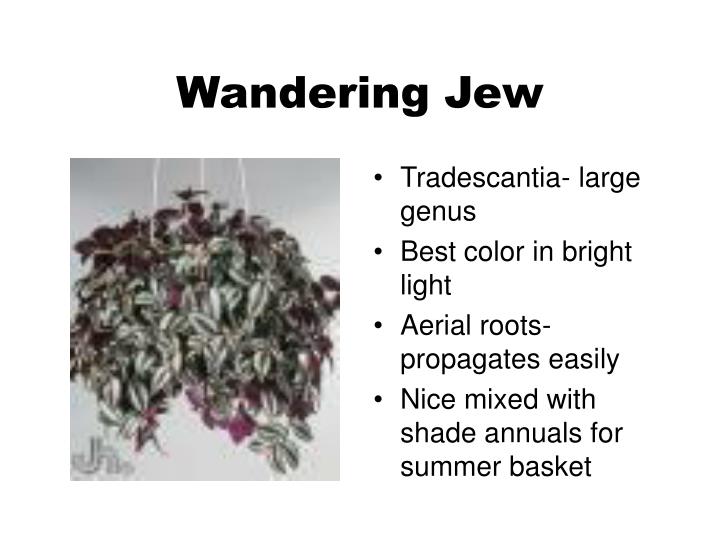
The image size is (720, 540). I want to click on plant, so click(x=222, y=308).